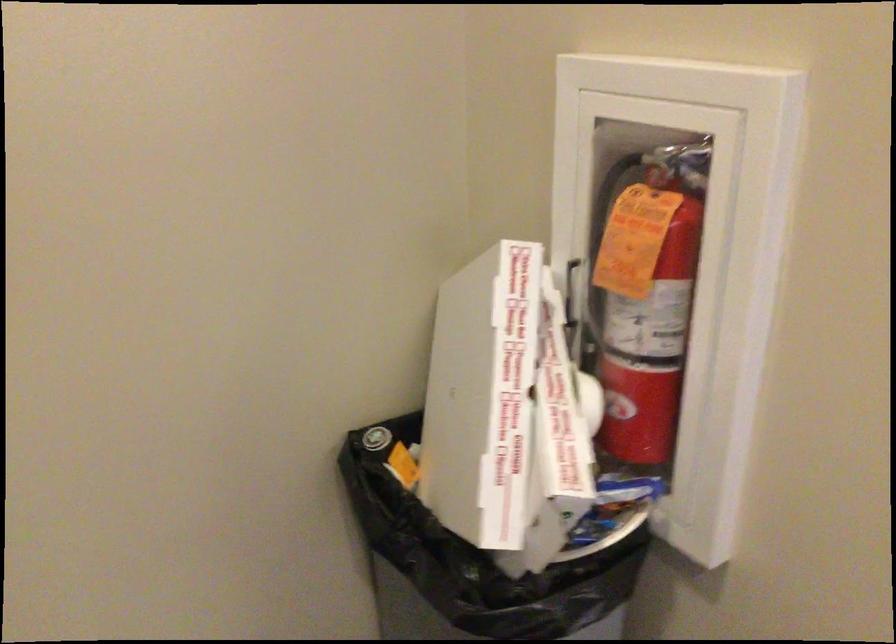
The image size is (896, 644). Find the location of `black cabinet handle`. black cabinet handle is located at coordinates (572, 290).